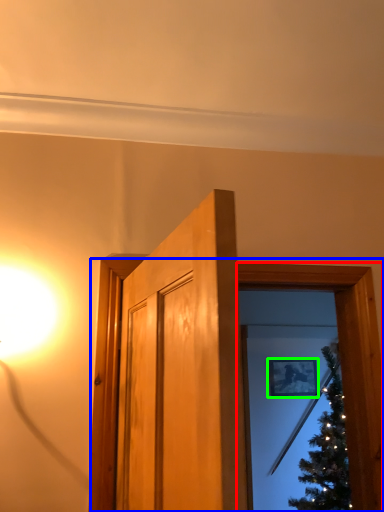
Question: Which is farther away from window frame (highlighted by a red box)? window frame (highlighted by a blue box) or picture frame (highlighted by a green box)?

Choices:
 (A) window frame
 (B) picture frame

Answer: (B)